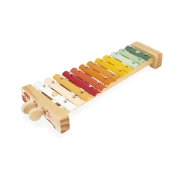
What are the coordinates of `sticker` in the screenshot? It's located at click(26, 96).